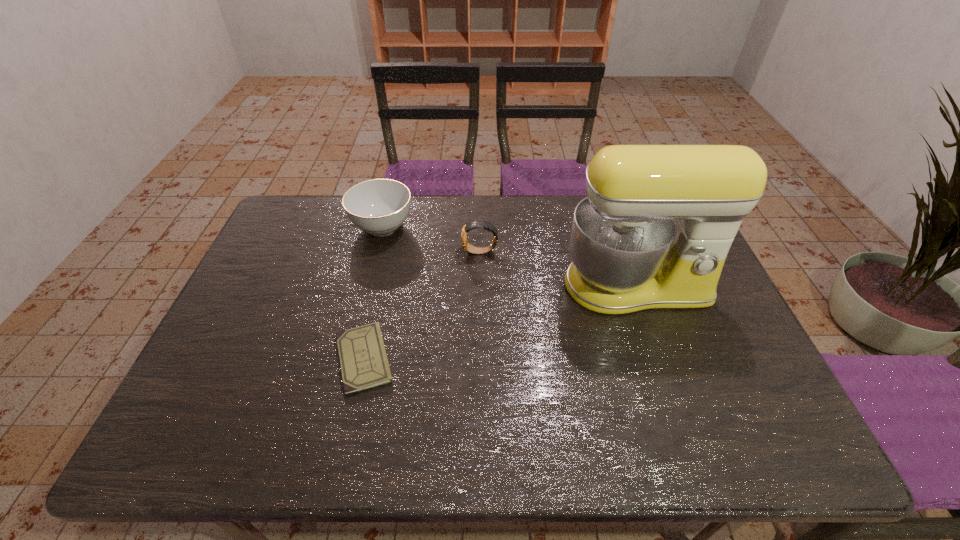
At what (x,y) coordinates should I click in order to perform the action: click on vacant area situated 0.140m on the face of the watch. Please return your answer as a coordinate pair (x, y). This screenshot has height=540, width=960. Looking at the image, I should click on (418, 252).

Where is `free space located 0.280m on the left of the nearest object`? free space located 0.280m on the left of the nearest object is located at coordinates click(220, 358).

What are the coordinates of `object present at the far edge` in the screenshot? It's located at (378, 207).

At what (x,y) coordinates should I click in order to perform the action: click on object situated at the right edge. Please return your answer as a coordinate pair (x, y). Looking at the image, I should click on (654, 232).

Find the location of `free point at the far edge`. free point at the far edge is located at coordinates (499, 220).

In the image, there is a desktop. At what (x,y) coordinates should I click in order to perform the action: click on vacant space at the near edge. Please return your answer as a coordinate pair (x, y). The image size is (960, 540). Looking at the image, I should click on (657, 420).

You are a GUI agent. You are given a task and a screenshot of the screen. Output one action in this format:
    pyautogui.click(x=<x>, y=<y>)
    Task: Click on the vacant space at the left edge
    Image resolution: width=960 pixels, height=540 pixels.
    Given the screenshot: What is the action you would take?
    pyautogui.click(x=294, y=259)

Find the location of a particular element. This screenshot has width=960, height=540. vacant area between the watch and the checkbook is located at coordinates (422, 305).

This screenshot has height=540, width=960. Find the location of `unoccupied position between the third object from left to right and the chinaware`. unoccupied position between the third object from left to right and the chinaware is located at coordinates (431, 240).

Find the location of a particular element. vacant space that is in between the mixer and the watch is located at coordinates [x=558, y=269].